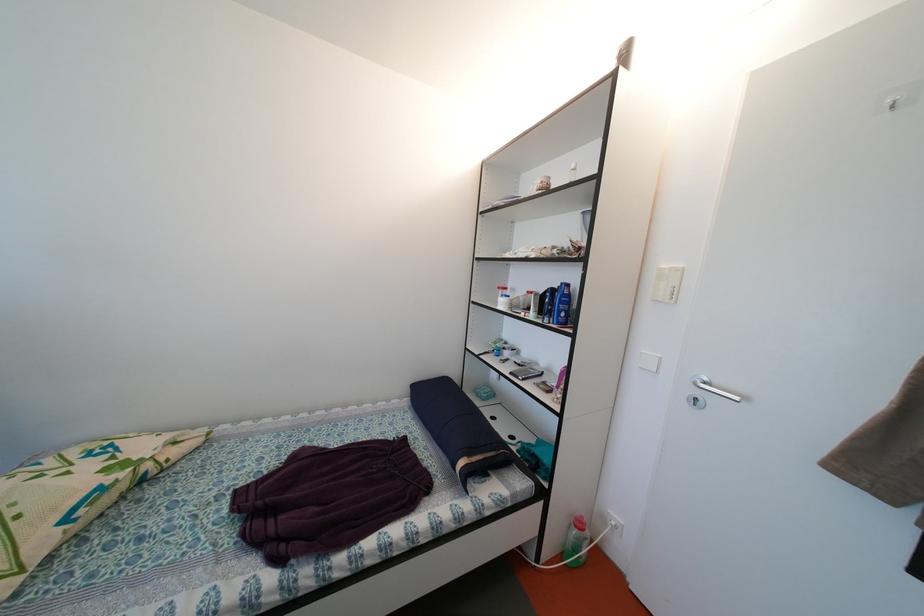
Where would you hang the clear wall hook? Please return your answer as a coordinate pair (x, y).

(751, 331)